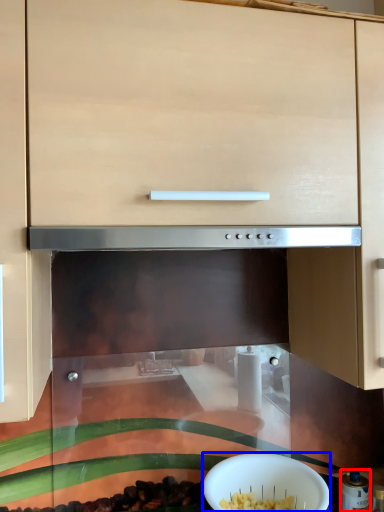
Question: Among these objects, which one is nearest to the camera, appliance (highlighted by a red box) or bowl (highlighted by a blue box)?

Choices:
 (A) appliance
 (B) bowl

Answer: (B)